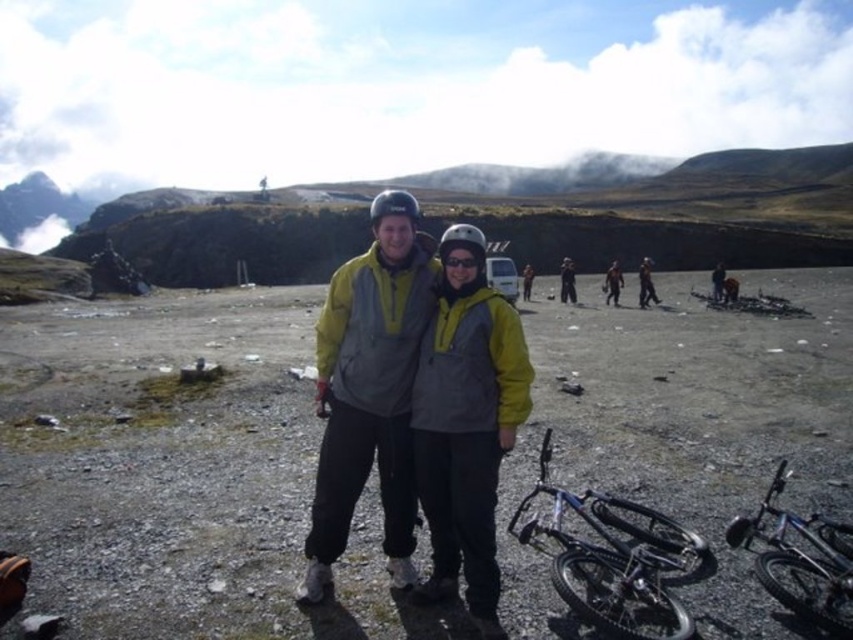
Question: Which of the following is the farthest from the observer?

Choices:
 (A) yellow matte jacket at center
 (B) black matte goggles at center
 (C) shiny metallic bicycle at lower right
 (D) yellow/grey fabric jacket at center

Answer: (B)

Question: In this image, where is shiny metallic bicycle at lower right located relative to black matte goggles at center?

Choices:
 (A) above
 (B) below

Answer: (B)

Question: From the image, what is the correct spatial relationship of shiny metallic bicycle at lower right in relation to black matte goggles at center?

Choices:
 (A) above
 (B) below

Answer: (B)

Question: Which point appears closest to the camera in this image?

Choices:
 (A) (815, 525)
 (B) (473, 259)
 (C) (469, 541)
 (D) (469, 209)

Answer: (C)

Question: Which point is closer to the camera?

Choices:
 (A) (486, 465)
 (B) (419, 298)
 (C) (668, 540)
 (D) (280, 204)

Answer: (C)

Question: Considering the relative positions of yellow matte jacket at center and black matte goggles at center in the image provided, where is yellow matte jacket at center located with respect to black matte goggles at center?

Choices:
 (A) left
 (B) right

Answer: (B)